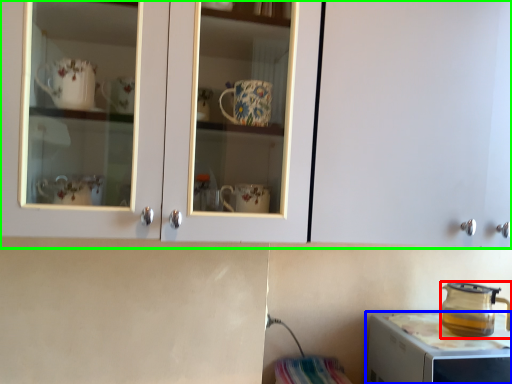
Question: Based on their relative distances, which object is farther from kitchen appliance (highlighted by a red box)? Choose from home appliance (highlighted by a blue box) and cabinetry (highlighted by a green box).

Choices:
 (A) home appliance
 (B) cabinetry

Answer: (B)